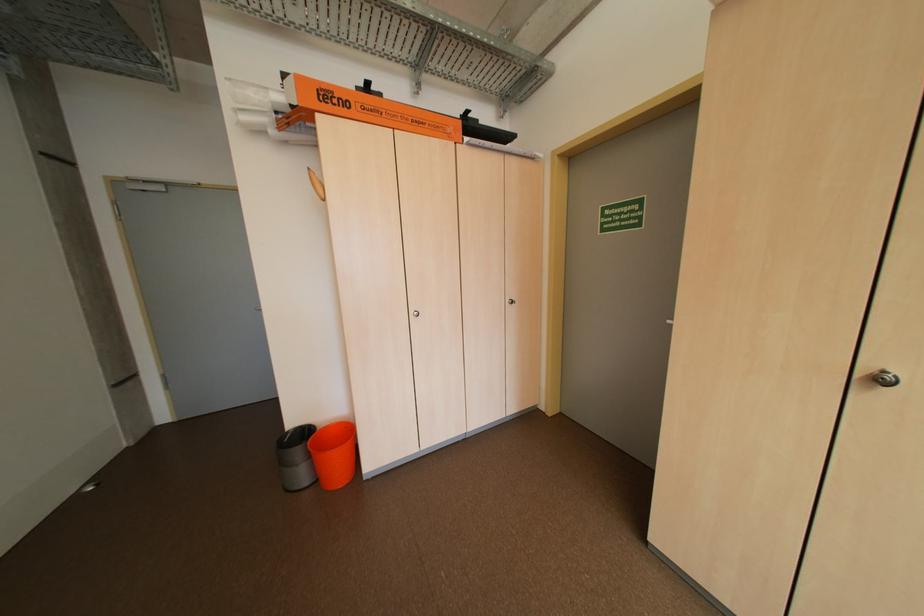
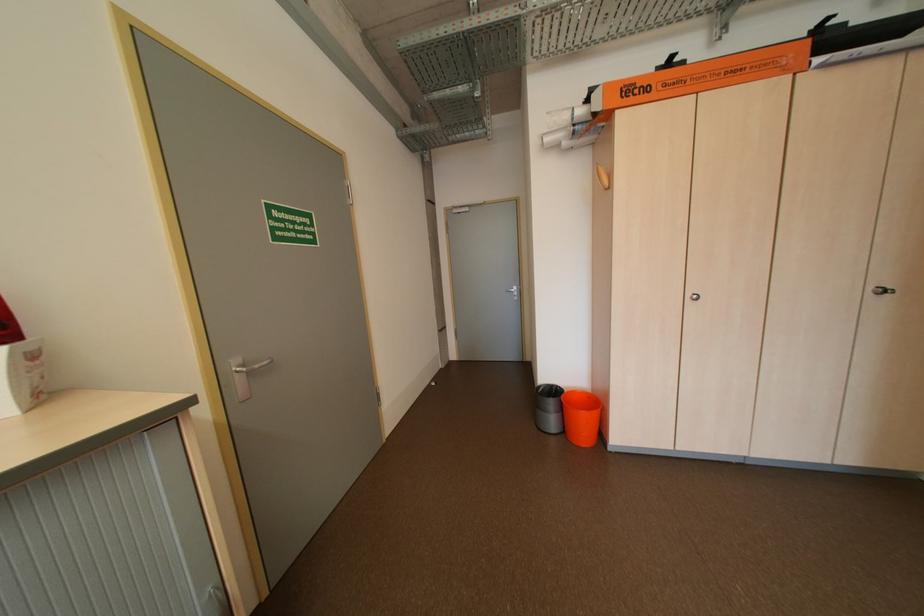
In the second image, find the point that corresponds to [356,105] in the first image.

(655, 90)